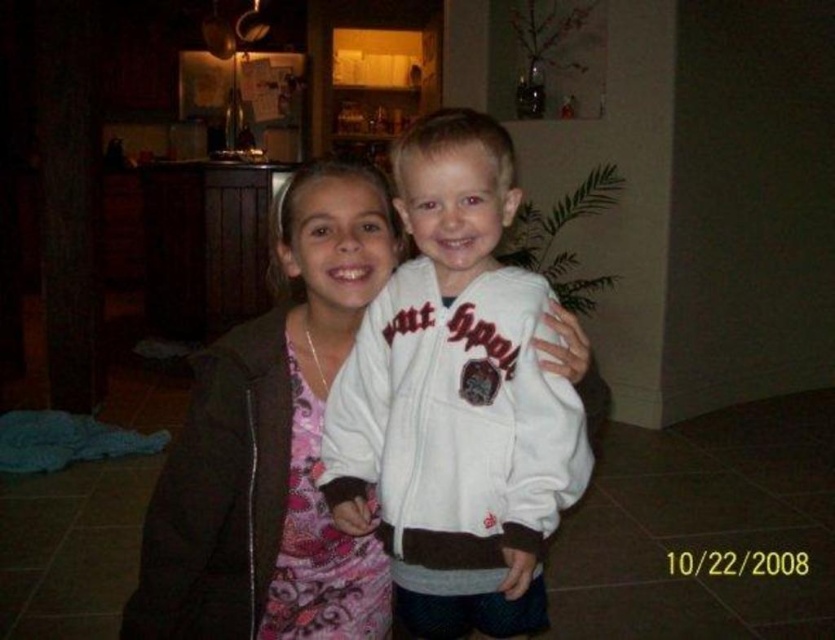
Question: Can you confirm if white fleece jacket at center is positioned above matte brown robe at center?

Choices:
 (A) yes
 (B) no

Answer: (A)

Question: Which point is closer to the camera?

Choices:
 (A) click(x=408, y=458)
 (B) click(x=266, y=465)

Answer: (A)

Question: Which point appears farthest from the camera in this image?

Choices:
 (A) (380, 509)
 (B) (152, 630)

Answer: (A)

Question: Can you confirm if white fleece jacket at center is positioned above matte brown robe at center?

Choices:
 (A) no
 (B) yes

Answer: (B)

Question: Can you confirm if white fleece jacket at center is wider than matte brown robe at center?

Choices:
 (A) no
 (B) yes

Answer: (A)